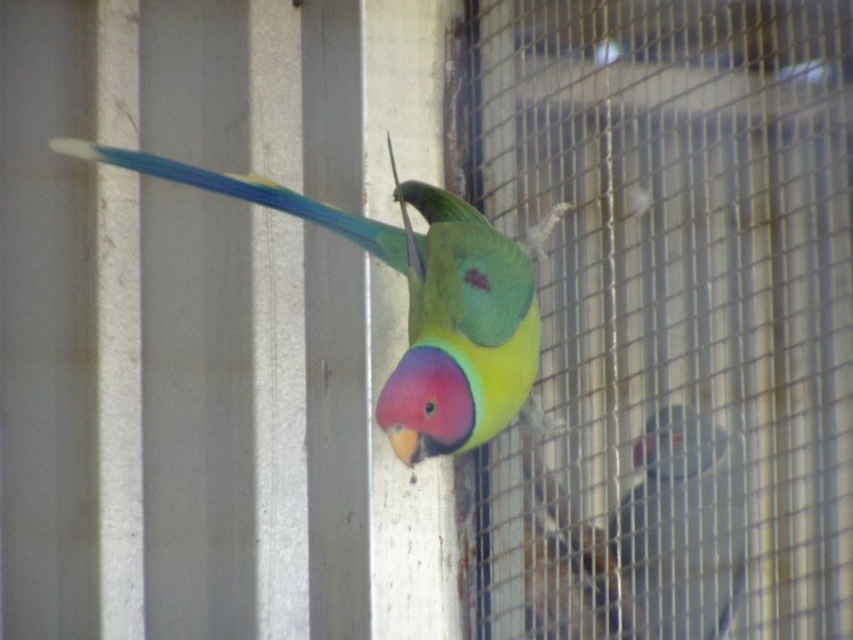
Question: Considering the relative positions of shiny green parrot at center and multicolored feathered parrot at center in the image provided, where is shiny green parrot at center located with respect to multicolored feathered parrot at center?

Choices:
 (A) below
 (B) above

Answer: (B)

Question: Considering the relative positions of shiny green parrot at center and multicolored feathered parrot at center in the image provided, where is shiny green parrot at center located with respect to multicolored feathered parrot at center?

Choices:
 (A) below
 (B) above

Answer: (B)

Question: Can you confirm if shiny green parrot at center is positioned to the left of multicolored feathered parrot at center?

Choices:
 (A) no
 (B) yes

Answer: (B)

Question: Which point is farther to the camera?

Choices:
 (A) multicolored feathered parrot at center
 (B) shiny green parrot at center

Answer: (A)

Question: Which object appears farthest from the camera in this image?

Choices:
 (A) multicolored feathered parrot at center
 (B) shiny green parrot at center

Answer: (A)

Question: Which of the following is the closest to the observer?

Choices:
 (A) multicolored feathered parrot at center
 (B) shiny green parrot at center

Answer: (B)